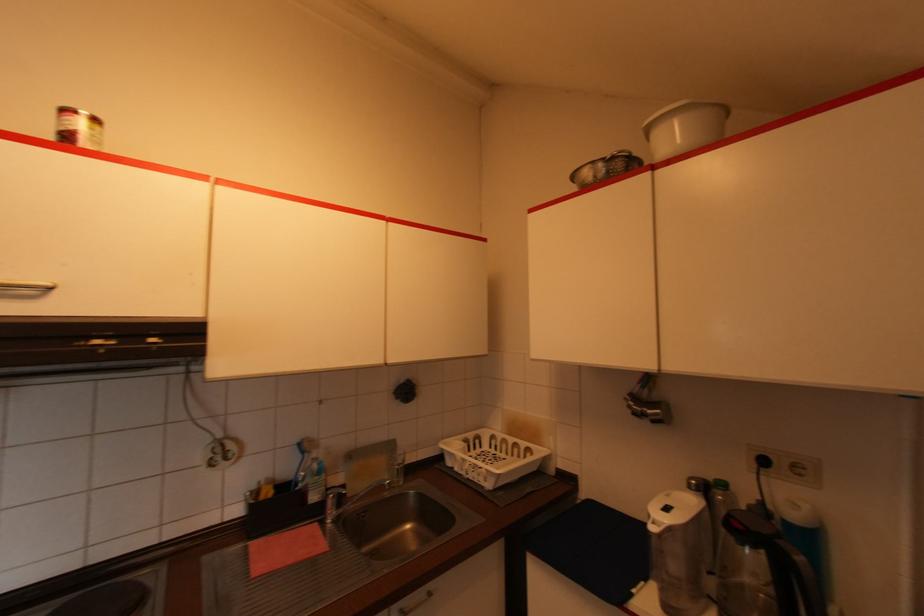
In order to click on kettle lid switch in this screenshot , I will do `click(665, 506)`.